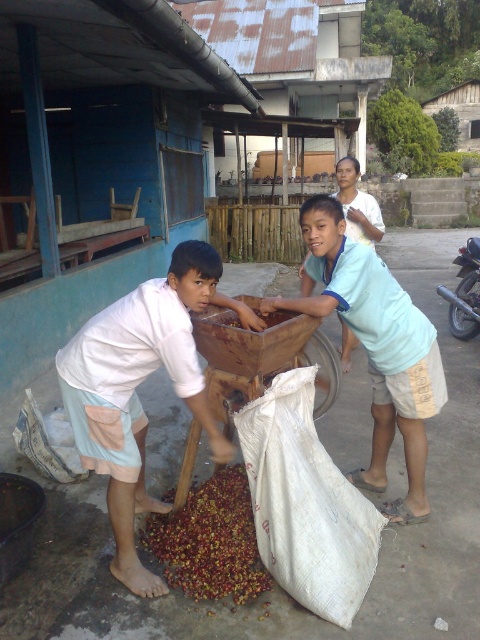
Question: Which object is the farthest from the light blue fabric shirt at center?

Choices:
 (A) brown matte food at center
 (B) light blue cotton shirt at center
 (C) red matte coffee beans at lower center

Answer: (C)

Question: Which of the following is the closest to the observer?

Choices:
 (A) white cotton shirt at left
 (B) light blue cotton shirt at center
 (C) red matte coffee beans at lower center
 (D) brown matte food at center

Answer: (A)

Question: Can you confirm if white cotton shirt at left is wider than red matte coffee beans at lower center?

Choices:
 (A) no
 (B) yes

Answer: (B)

Question: Which point is farther to the camera?

Choices:
 (A) (173, 538)
 (B) (80, 356)
 (C) (349, 205)

Answer: (C)

Question: Is light blue fabric shirt at center further to the viewer compared to brown matte food at center?

Choices:
 (A) yes
 (B) no

Answer: (A)

Question: Considering the relative positions of white cotton shirt at left and red matte coffee beans at lower center in the image provided, where is white cotton shirt at left located with respect to red matte coffee beans at lower center?

Choices:
 (A) below
 (B) above

Answer: (B)